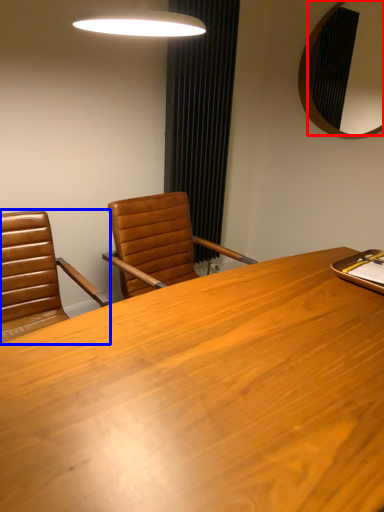
Question: Which object appears farthest to the camera in this image, mirror (highlighted by a red box) or chair (highlighted by a blue box)?

Choices:
 (A) mirror
 (B) chair

Answer: (A)